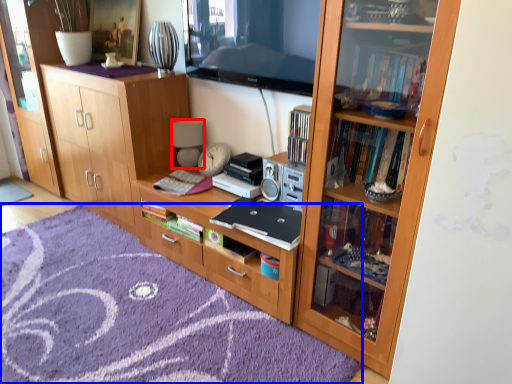
Question: Which of the following is the farthest to the observer, lamp (highlighted by a red box) or doormat (highlighted by a blue box)?

Choices:
 (A) lamp
 (B) doormat

Answer: (A)